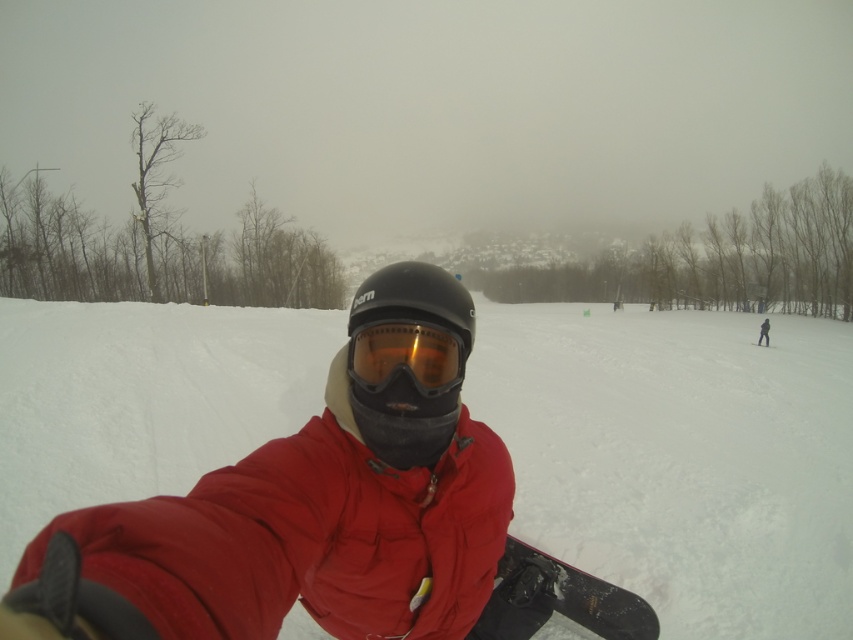
Based on the photo, you are a drone operator trying to capture the best aerial shot of the scene. The matte black helmet at center is your main subject. Based on its position, what coordinates should you aim for to ensure it stays in the frame?

The matte black helmet at center is located at coordinates point (x=408, y=360), so aim your drone camera at those coordinates to keep it centered in the frame.

You are standing at the edge of a snowy slope and want to take a selfie with the white matte snow at center. Where should you position yourself to capture the snow in the center of your photo?

You should position yourself at point [680,458] to capture the white matte snow at center in the center of your photo.